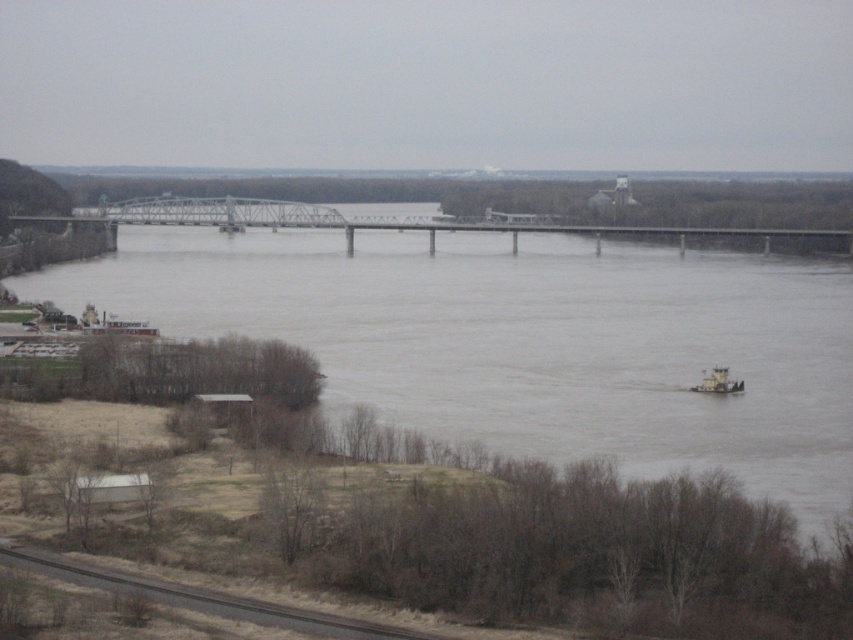
Question: Is metallic gray bridge at center to the left of metallic gray tugboat at lower right from the viewer's perspective?

Choices:
 (A) yes
 (B) no

Answer: (A)

Question: Which object is the closest to the metallic gray bridge at center?

Choices:
 (A) gray concrete river at center
 (B) metallic gray tugboat at lower right

Answer: (A)

Question: Which object appears closest to the camera in this image?

Choices:
 (A) metallic gray bridge at center
 (B) dark gray asphalt train track at lower left

Answer: (B)

Question: Which is farther from the dark gray asphalt train track at lower left?

Choices:
 (A) gray concrete river at center
 (B) metallic gray bridge at center

Answer: (B)

Question: Can you confirm if metallic gray bridge at center is wider than dark gray asphalt train track at lower left?

Choices:
 (A) yes
 (B) no

Answer: (A)

Question: Is gray concrete river at center below metallic gray tugboat at lower right?

Choices:
 (A) yes
 (B) no

Answer: (B)